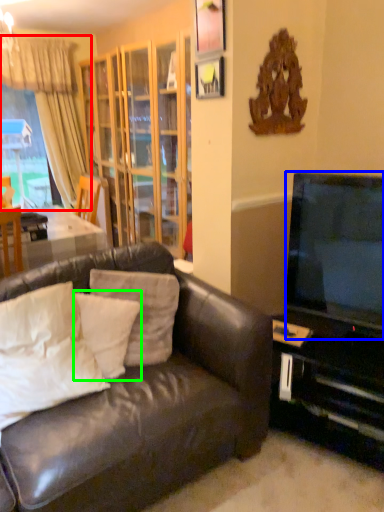
Question: Based on their relative distances, which object is nearer to curtain (highlighted by a red box)? Choose from television (highlighted by a blue box) and pillow (highlighted by a green box).

Choices:
 (A) television
 (B) pillow

Answer: (B)